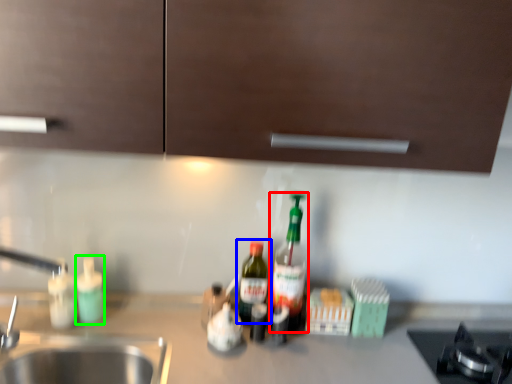
Question: Which is nearer to the bottle (highlighted by a red box)? bottle (highlighted by a blue box) or bottle (highlighted by a green box).

Choices:
 (A) bottle
 (B) bottle

Answer: (A)